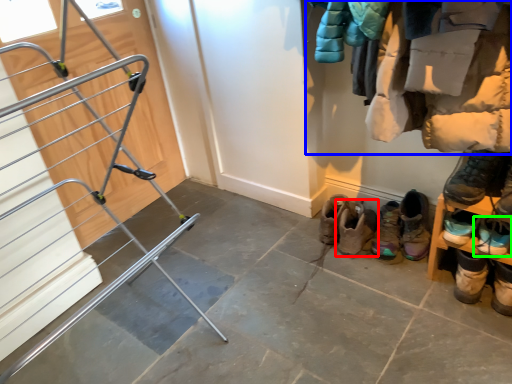
Question: Estimate the real-world distances between objects in this image. Which object is farther from footwear (highlighted by a red box), closet (highlighted by a blue box) or footwear (highlighted by a green box)?

Choices:
 (A) closet
 (B) footwear

Answer: (A)